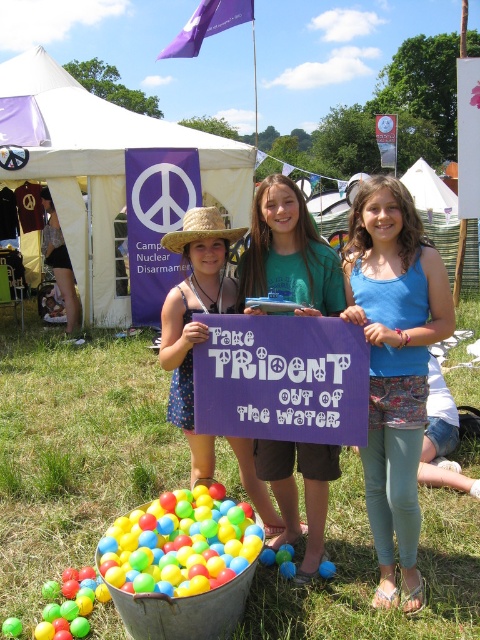
Who is higher up, multicolored plastic balls at lower left or polka dot dress at center?

polka dot dress at center is above.

Image resolution: width=480 pixels, height=640 pixels. Describe the element at coordinates (180, 545) in the screenshot. I see `multicolored plastic balls at lower left` at that location.

You are a GUI agent. You are given a task and a screenshot of the screen. Output one action in this format:
    pyautogui.click(x=<x>, y=<y>)
    Task: Click on the multicolored plastic balls at lower left
    Image resolution: width=480 pixels, height=640 pixels.
    Given the screenshot: What is the action you would take?
    pyautogui.click(x=180, y=545)

Who is higher up, blue denim shorts at lower center or matte purple sign at center?

blue denim shorts at lower center is higher up.

Does blue denim shorts at lower center appear on the right side of matte purple sign at center?

Correct, you'll find blue denim shorts at lower center to the right of matte purple sign at center.

Describe the element at coordinates (395, 365) in the screenshot. I see `blue denim shorts at lower center` at that location.

Locate an element on the screen. Image resolution: width=480 pixels, height=640 pixels. blue denim shorts at lower center is located at coordinates (395, 365).

Consider the image. Can you confirm if polka dot dress at center is taller than strawmaterial/texturehat at center?

Indeed, polka dot dress at center has a greater height compared to strawmaterial/texturehat at center.

Where is `polka dot dress at center`? This screenshot has width=480, height=640. polka dot dress at center is located at coordinates (193, 321).